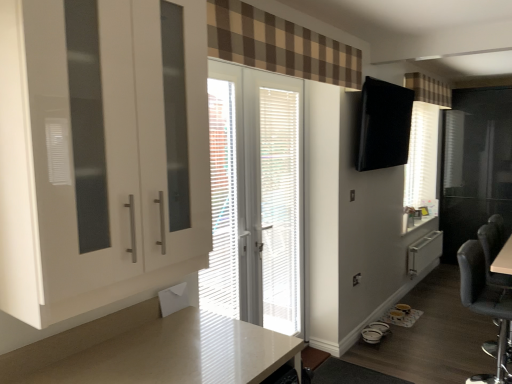
Where is `white glossy countertop at lower center`? white glossy countertop at lower center is located at coordinates (177, 354).

The width and height of the screenshot is (512, 384). Describe the element at coordinates (101, 153) in the screenshot. I see `white glossy cabinet at left` at that location.

Find the location of a particular element. white/textured blinds at center is located at coordinates (280, 209).

The height and width of the screenshot is (384, 512). I want to click on black fabric chair at lower right, so click(485, 305).

Where is `brown checkered curtain at upper right, positioned as the 1th curtain in right-to-left order`? brown checkered curtain at upper right, positioned as the 1th curtain in right-to-left order is located at coordinates (428, 89).

This screenshot has height=384, width=512. In order to click on brown checkered curtain at upper center, arranged as the 1th curtain when ordered from the bottom in this screenshot , I will do `click(279, 45)`.

Measure the distance between white glossy door at center and camera.

The distance of white glossy door at center from camera is 7.37 feet.

The height and width of the screenshot is (384, 512). What do you see at coordinates (255, 197) in the screenshot? I see `white glossy door at center` at bounding box center [255, 197].

The height and width of the screenshot is (384, 512). Find the location of `white glossy countertop at lower center`. white glossy countertop at lower center is located at coordinates (177, 354).

From the picture: Are black fabric chair at lower right and brown checkered curtain at upper right, marked as the 2th curtain in a left-to-right arrangement, far apart?

Indeed, black fabric chair at lower right is not near brown checkered curtain at upper right, marked as the 2th curtain in a left-to-right arrangement.

Which object is further away from the camera, black fabric chair at lower right or brown checkered curtain at upper right, arranged as the second curtain when ordered from the bottom?

brown checkered curtain at upper right, arranged as the second curtain when ordered from the bottom, is further away from the camera.

From the image's perspective, which one is positioned higher, black fabric chair at lower right or brown checkered curtain at upper right, arranged as the 2th curtain when viewed from the front?

brown checkered curtain at upper right, arranged as the 2th curtain when viewed from the front, appears higher in the image.

Can you confirm if black fabric chair at lower right is shorter than brown checkered curtain at upper right, arranged as the second curtain when ordered from the bottom?

Incorrect, the height of black fabric chair at lower right does not fall short of that of brown checkered curtain at upper right, arranged as the second curtain when ordered from the bottom.

Based on the photo, do you think brown checkered curtain at upper right, marked as the 2th curtain in a left-to-right arrangement, is within white/textured blinds at center, or outside of it?

brown checkered curtain at upper right, marked as the 2th curtain in a left-to-right arrangement, is spatially situated outside white/textured blinds at center.

Is brown checkered curtain at upper right, positioned as the 1th curtain in right-to-left order, positioned in front of white/textured blinds at center?

That is False.

From a real-world perspective, is brown checkered curtain at upper right, marked as the 2th curtain in a left-to-right arrangement, over white/textured blinds at center?

Yes, from a real-world perspective, brown checkered curtain at upper right, marked as the 2th curtain in a left-to-right arrangement, is above white/textured blinds at center.

Based on the photo, considering the sizes of objects white glossy cabinet at left and brown checkered curtain at upper center, which is the 2th curtain in back-to-front order, in the image provided, who is wider, white glossy cabinet at left or brown checkered curtain at upper center, which is the 2th curtain in back-to-front order,?

white glossy cabinet at left is wider.

I want to click on cabinetry that is under the brown checkered curtain at upper center, acting as the 2th curtain starting from the right (from a real-world perspective), so click(x=101, y=153).

Does white glossy cabinet at left touch brown checkered curtain at upper center, arranged as the 1th curtain when ordered from the bottom?

They are not placed beside each other.

Can you tell me how much white glossy cabinet at left and brown checkered curtain at upper center, placed as the 1th curtain when sorted from front to back, differ in facing direction?

The angular difference between white glossy cabinet at left and brown checkered curtain at upper center, placed as the 1th curtain when sorted from front to back, is 0.000941 degrees.

Where is `file cabinet below the brown checkered curtain at upper right, arranged as the second curtain when ordered from the bottom (from the image's perspective)`? file cabinet below the brown checkered curtain at upper right, arranged as the second curtain when ordered from the bottom (from the image's perspective) is located at coordinates (424, 252).

Considering the points (430, 239) and (429, 79), which point is in front, point (430, 239) or point (429, 79)?

Point (429, 79)

Can you confirm if white plastic radiator at lower right is positioned to the left of brown checkered curtain at upper right, positioned as the 1th curtain in right-to-left order?

In fact, white plastic radiator at lower right is to the right of brown checkered curtain at upper right, positioned as the 1th curtain in right-to-left order.

Is brown checkered curtain at upper right, positioned as the 1th curtain in back-to-front order, surrounding white glossy countertop at lower center?

No, white glossy countertop at lower center is not a part of brown checkered curtain at upper right, positioned as the 1th curtain in back-to-front order.

Is brown checkered curtain at upper right, positioned as the first curtain in top-to-bottom order, directly adjacent to white glossy countertop at lower center?

They are not placed beside each other.

Considering the relative sizes of brown checkered curtain at upper right, positioned as the 1th curtain in back-to-front order, and white glossy countertop at lower center in the image provided, is brown checkered curtain at upper right, positioned as the 1th curtain in back-to-front order, thinner than white glossy countertop at lower center?

Indeed, brown checkered curtain at upper right, positioned as the 1th curtain in back-to-front order, has a lesser width compared to white glossy countertop at lower center.

Considering the points (444, 104) and (192, 377), which point is behind, point (444, 104) or point (192, 377)?

The point (444, 104) is behind.

Considering the relative sizes of black fabric chair at lower right and white glossy cabinet at left in the image provided, is black fabric chair at lower right bigger than white glossy cabinet at left?

No, black fabric chair at lower right is not bigger than white glossy cabinet at left.

Is black fabric chair at lower right outside of white glossy cabinet at left?

Indeed, black fabric chair at lower right is completely outside white glossy cabinet at left.

From the image's perspective, relative to white glossy cabinet at left, is black fabric chair at lower right above or below?

From the image's perspective, black fabric chair at lower right appears below white glossy cabinet at left.

Between brown checkered curtain at upper center, acting as the 2th curtain starting from the right, and white glossy countertop at lower center, which one appears on the left side from the viewer's perspective?

white glossy countertop at lower center is more to the left.

Does brown checkered curtain at upper center, which is the 2th curtain in back-to-front order, have a larger size compared to white glossy countertop at lower center?

Incorrect, brown checkered curtain at upper center, which is the 2th curtain in back-to-front order, is not larger than white glossy countertop at lower center.

Considering the relative positions of brown checkered curtain at upper center, the 2th curtain when ordered from top to bottom, and white glossy countertop at lower center in the image provided, is brown checkered curtain at upper center, the 2th curtain when ordered from top to bottom, in front of white glossy countertop at lower center?

That is False.

Is brown checkered curtain at upper center, which is the 2th curtain in back-to-front order, facing away from white glossy countertop at lower center?

No.

Find the location of a particular element. the 2nd curtain directly above the black fabric chair at lower right (from a real-world perspective) is located at coordinates (428, 89).

This screenshot has height=384, width=512. I want to click on blind below the brown checkered curtain at upper right, positioned as the first curtain in top-to-bottom order (from the image's perspective), so click(280, 209).

Estimate the real-world distances between objects in this image. Which object is closer to white glossy cabinet at left, white/textured blinds at center or white plastic radiator at lower right?

The object closer to white glossy cabinet at left is white/textured blinds at center.

Looking at the image, which one is located closer to white plastic radiator at lower right, white glossy door at center or brown checkered curtain at upper center, the 2th curtain when ordered from top to bottom?

white glossy door at center is positioned closer to the anchor white plastic radiator at lower right.

Based on the photo, considering their positions, is white/textured blinds at center positioned closer to black fabric chair at lower right than white plastic radiator at lower right?

white/textured blinds at center lies closer to black fabric chair at lower right than the other object.

Based on their spatial positions, is white glossy door at center or black fabric chair at lower right further from white glossy countertop at lower center?

black fabric chair at lower right lies further to white glossy countertop at lower center than the other object.

From the picture: When comparing their distances from white/textured blinds at center, does white glossy cabinet at left or black fabric chair at lower right seem further?

white glossy cabinet at left is further to white/textured blinds at center.

Estimate the real-world distances between objects in this image. Which object is closer to brown checkered curtain at upper right, arranged as the 2th curtain when viewed from the front, black fabric chair at lower right or white glossy cabinet at left?

black fabric chair at lower right is closer to brown checkered curtain at upper right, arranged as the 2th curtain when viewed from the front.

Considering their positions, is white/textured blinds at center positioned closer to brown checkered curtain at upper center, the 2th curtain when ordered from top to bottom, than brown checkered curtain at upper right, marked as the 2th curtain in a left-to-right arrangement?

white/textured blinds at center.

When comparing their distances from white glossy countertop at lower center, does white glossy cabinet at left or brown checkered curtain at upper center, which is the 2th curtain in back-to-front order, seem closer?

Among the two, white glossy cabinet at left is located nearer to white glossy countertop at lower center.

You are a GUI agent. You are given a task and a screenshot of the screen. Output one action in this format:
    pyautogui.click(x=<x>, y=<y>)
    Task: Click on the cabinetry between brown checkered curtain at upper center, the 2th curtain when ordered from top to bottom, and white glossy countertop at lower center vertically
    The image size is (512, 384).
    Given the screenshot: What is the action you would take?
    pyautogui.click(x=101, y=153)

The image size is (512, 384). In order to click on blind between brown checkered curtain at upper center, arranged as the 1th curtain when ordered from the bottom, and brown checkered curtain at upper right, marked as the 2th curtain in a left-to-right arrangement, from front to back in this screenshot , I will do `click(280, 209)`.

Where is `door between brown checkered curtain at upper center, which is counted as the first curtain, starting from the left, and brown checkered curtain at upper right, arranged as the 2th curtain when viewed from the front, from front to back`? door between brown checkered curtain at upper center, which is counted as the first curtain, starting from the left, and brown checkered curtain at upper right, arranged as the 2th curtain when viewed from the front, from front to back is located at coordinates (255, 197).

Find the location of a particular element. curtain between white glossy cabinet at left and white glossy door at center in the front-back direction is located at coordinates (279, 45).